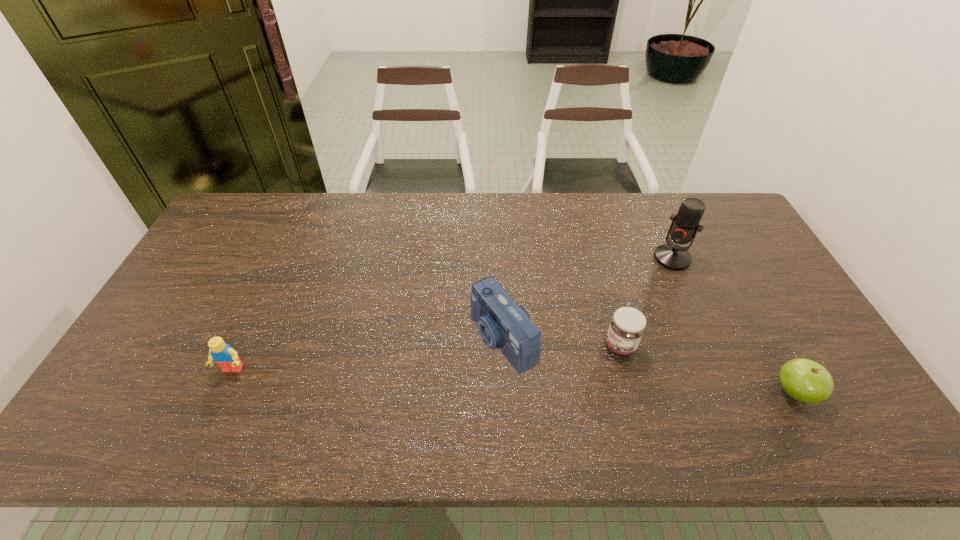
This screenshot has width=960, height=540. In order to click on vacant space in between the leftmost object and the second object from right to left in this screenshot , I will do point(452,314).

Where is `free spot between the apple and the leftmost object`? The image size is (960, 540). free spot between the apple and the leftmost object is located at coordinates (514, 381).

Find the location of `vacant space in between the jam and the apple`. vacant space in between the jam and the apple is located at coordinates (707, 369).

Find the location of a particular element. This screenshot has width=960, height=540. vacant area that lies between the leftmost object and the camera is located at coordinates (368, 354).

The image size is (960, 540). I want to click on empty location between the camera and the microphone, so click(588, 299).

This screenshot has width=960, height=540. I want to click on free space between the jam and the microphone, so click(646, 302).

The width and height of the screenshot is (960, 540). I want to click on empty space that is in between the camera and the third object from right to left, so click(562, 343).

The image size is (960, 540). In order to click on free spot between the third object from left to right and the microphone in this screenshot , I will do `click(646, 302)`.

Find the location of a particular element. The width and height of the screenshot is (960, 540). object that stands as the second closest to the leftmost object is located at coordinates (627, 326).

The height and width of the screenshot is (540, 960). I want to click on the second closest object to the leftmost object, so click(627, 326).